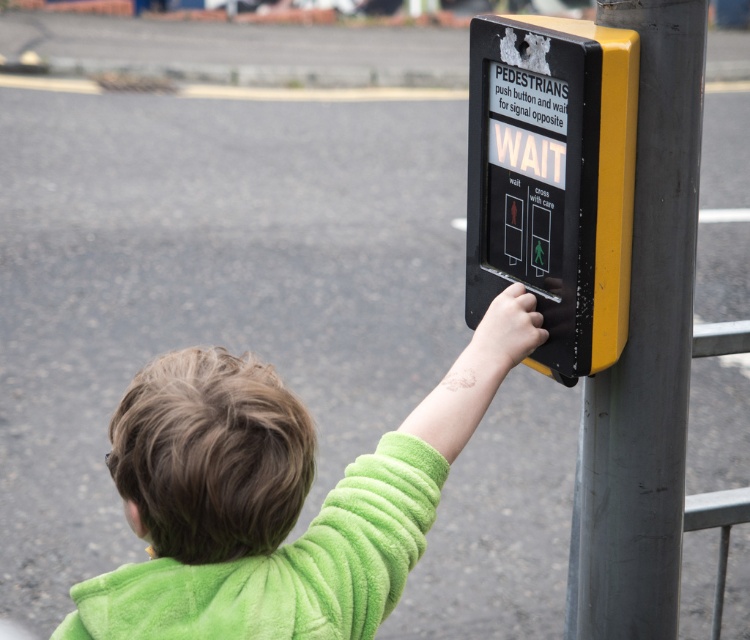
Does black plastic pedestrian signal at center have a larger size compared to green fuzzy sweatshirt at upper right?

Correct, black plastic pedestrian signal at center is larger in size than green fuzzy sweatshirt at upper right.

This screenshot has width=750, height=640. What do you see at coordinates (554, 179) in the screenshot? I see `black plastic pedestrian signal at center` at bounding box center [554, 179].

I want to click on black plastic pedestrian signal at center, so click(x=554, y=179).

Is green fuzzy sweater at center positioned at the back of metallic gray pole at right?

No, green fuzzy sweater at center is closer to the viewer.

From the picture: Is green fuzzy sweater at center below metallic gray pole at right?

Yes.

Is point (189, 378) positioned in front of point (680, 230)?

That is True.

Identify the location of green fuzzy sweater at center. This screenshot has height=640, width=750. (285, 500).

Can you confirm if metallic gray pole at right is wider than black plastic pedestrian signal at center?

Incorrect, metallic gray pole at right's width does not surpass black plastic pedestrian signal at center's.

Who is more forward, (579, 512) or (574, 372)?

Point (574, 372)

The image size is (750, 640). Identify the location of metallic gray pole at right. (645, 353).